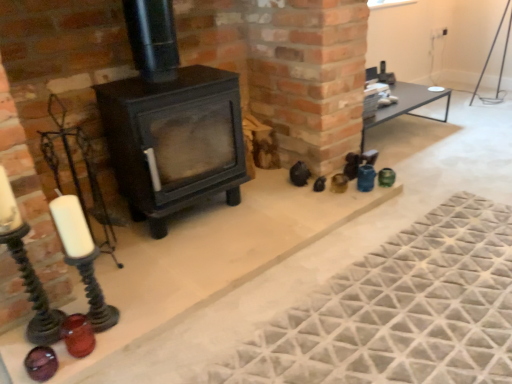
Question: Can you confirm if textured gray mat at lower right is thinner than translucent amber glass candle holder at lower left?

Choices:
 (A) no
 (B) yes

Answer: (A)

Question: From the image's perspective, is textured gray mat at lower right over translucent amber glass candle holder at lower left?

Choices:
 (A) no
 (B) yes

Answer: (B)

Question: Is textured gray mat at lower right positioned with its back to translucent amber glass candle holder at lower left?

Choices:
 (A) no
 (B) yes

Answer: (A)

Question: Is textured gray mat at lower right beside translucent amber glass candle holder at lower left?

Choices:
 (A) no
 (B) yes

Answer: (A)

Question: Can translucent amber glass candle holder at lower left be found inside textured gray mat at lower right?

Choices:
 (A) yes
 (B) no

Answer: (B)

Question: Does point (77, 357) appear closer or farther from the camera than point (505, 337)?

Choices:
 (A) closer
 (B) farther

Answer: (B)

Question: From their relative heights in the image, would you say translucent amber glass candle holder at lower left is taller or shorter than textured gray mat at lower right?

Choices:
 (A) short
 (B) tall

Answer: (B)

Question: In terms of size, does translucent amber glass candle holder at lower left appear bigger or smaller than textured gray mat at lower right?

Choices:
 (A) small
 (B) big

Answer: (A)

Question: From the image's perspective, is translucent amber glass candle holder at lower left positioned above or below textured gray mat at lower right?

Choices:
 (A) below
 (B) above

Answer: (A)

Question: Is textured gray mat at lower right taller or shorter than matte black wood burning stove at center?

Choices:
 (A) short
 (B) tall

Answer: (A)

Question: Is point (259, 370) positioned closer to the camera than point (196, 119)?

Choices:
 (A) farther
 (B) closer

Answer: (B)

Question: Is textured gray mat at lower right situated inside matte black wood burning stove at center or outside?

Choices:
 (A) inside
 (B) outside

Answer: (B)

Question: Is textured gray mat at lower right wider or thinner than matte black wood burning stove at center?

Choices:
 (A) wide
 (B) thin

Answer: (A)

Question: From their relative heights in the image, would you say matte black stove at center is taller or shorter than textured gray mat at lower right?

Choices:
 (A) short
 (B) tall

Answer: (B)

Question: Considering the positions of matte black stove at center and textured gray mat at lower right in the image, is matte black stove at center bigger or smaller than textured gray mat at lower right?

Choices:
 (A) small
 (B) big

Answer: (B)